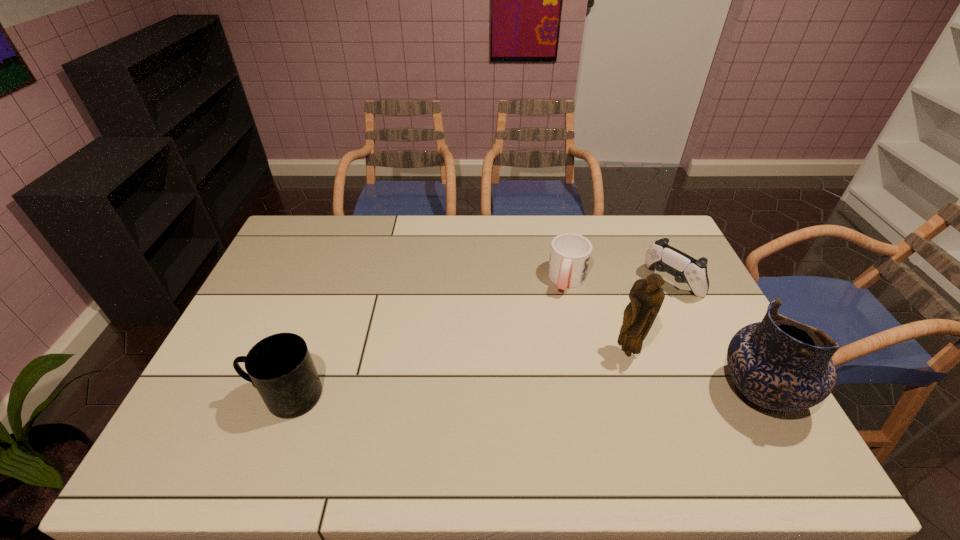
This screenshot has width=960, height=540. I want to click on vacant space that is in between the third object from right to left and the shorter mug, so click(x=598, y=316).

At what (x,y) coordinates should I click in order to perform the action: click on vacant space that's between the second object from left to right and the third object from left to right. Please return your answer as a coordinate pair (x, y). Looking at the image, I should click on (598, 316).

Identify the location of free space that is in between the control and the nearer mug. (479, 339).

The width and height of the screenshot is (960, 540). Find the location of `the second closest object relative to the nearer mug`. the second closest object relative to the nearer mug is located at coordinates (646, 295).

The width and height of the screenshot is (960, 540). In order to click on object that stands as the third closest to the right mug in this screenshot , I will do `click(779, 364)`.

Where is `vacant space that satisfies the following two spatial constraints: 1. on the front side of the third object from left to right; 2. on the right side of the fourth object from right to left`? This screenshot has height=540, width=960. vacant space that satisfies the following two spatial constraints: 1. on the front side of the third object from left to right; 2. on the right side of the fourth object from right to left is located at coordinates coord(584,353).

Identify the location of vacant space that satisfies the following two spatial constraints: 1. on the front side of the third object from left to right; 2. on the right side of the pottery. (641, 394).

Locate an element on the screen. The image size is (960, 540). free space that satisfies the following two spatial constraints: 1. on the front side of the pottery; 2. on the left side of the control is located at coordinates (724, 394).

The width and height of the screenshot is (960, 540). I want to click on vacant space that satisfies the following two spatial constraints: 1. on the front side of the pottery; 2. on the right side of the right mug, so click(592, 394).